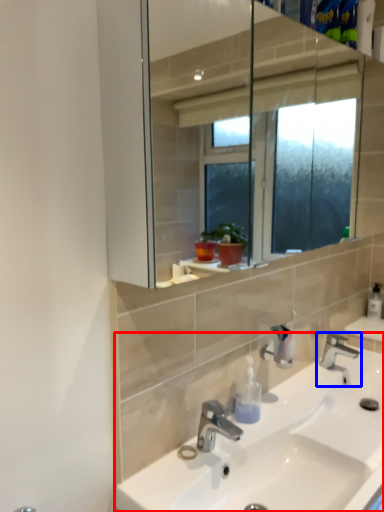
Question: Which point is further to the camera, sink (highlighted by a red box) or tap (highlighted by a blue box)?

Choices:
 (A) sink
 (B) tap

Answer: (B)